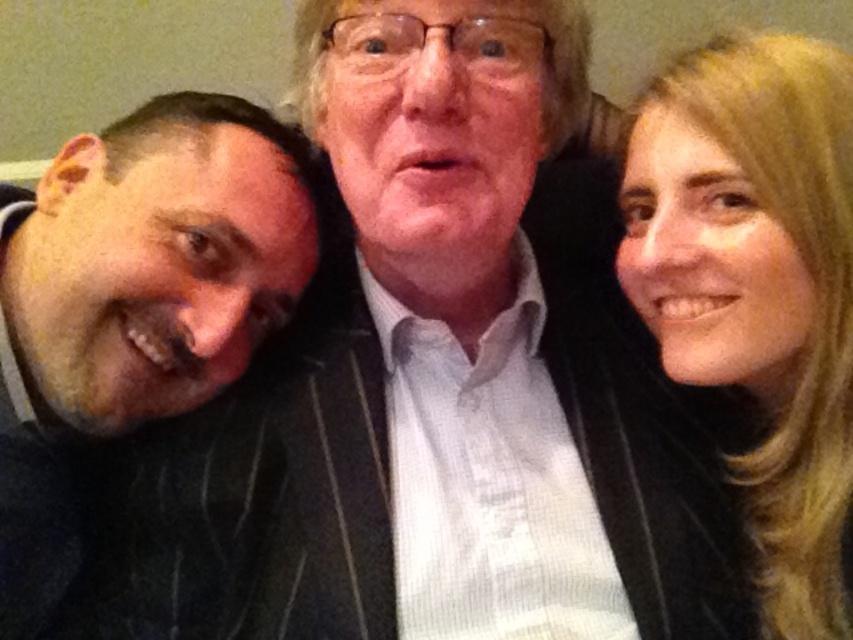
Can you confirm if dark pinstripe suit at left is taller than blonde hair at upper right?

No, dark pinstripe suit at left is not taller than blonde hair at upper right.

Is dark pinstripe suit at left wider than blonde hair at upper right?

Yes, dark pinstripe suit at left is wider than blonde hair at upper right.

Is point (67, 518) more distant than point (714, 320)?

Yes, it is behind point (714, 320).

This screenshot has height=640, width=853. What are the coordinates of `dark pinstripe suit at left` in the screenshot? It's located at (132, 301).